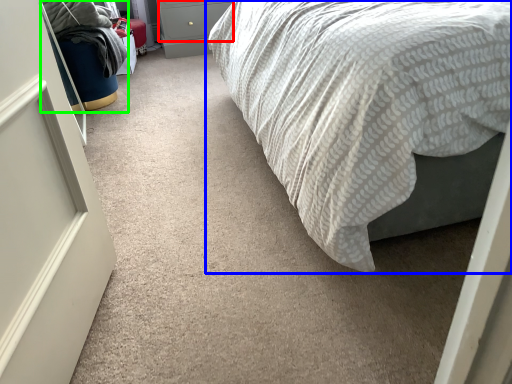
Question: Which object is the closest to the drawer (highlighted by a red box)? Choose among these: bed (highlighted by a blue box) or bean bag chair (highlighted by a green box).

Choices:
 (A) bed
 (B) bean bag chair

Answer: (B)